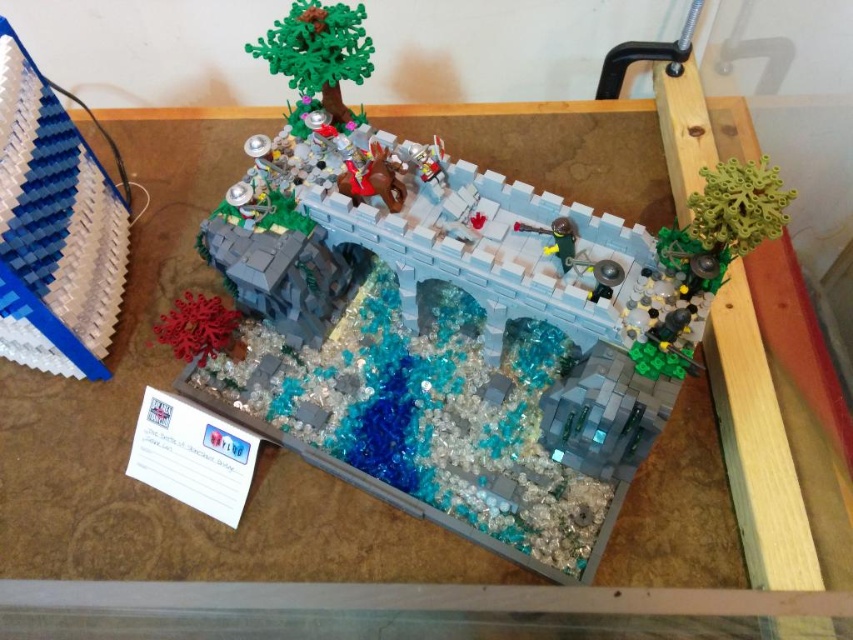
Does point (68, 362) lie in front of point (347, 20)?

No, (68, 362) is behind (347, 20).

Does point (4, 346) come behind point (318, 40)?

Yes, point (4, 346) is farther from viewer.

The image size is (853, 640). What are the coordinates of `blue matte foam at left` in the screenshot? It's located at (53, 228).